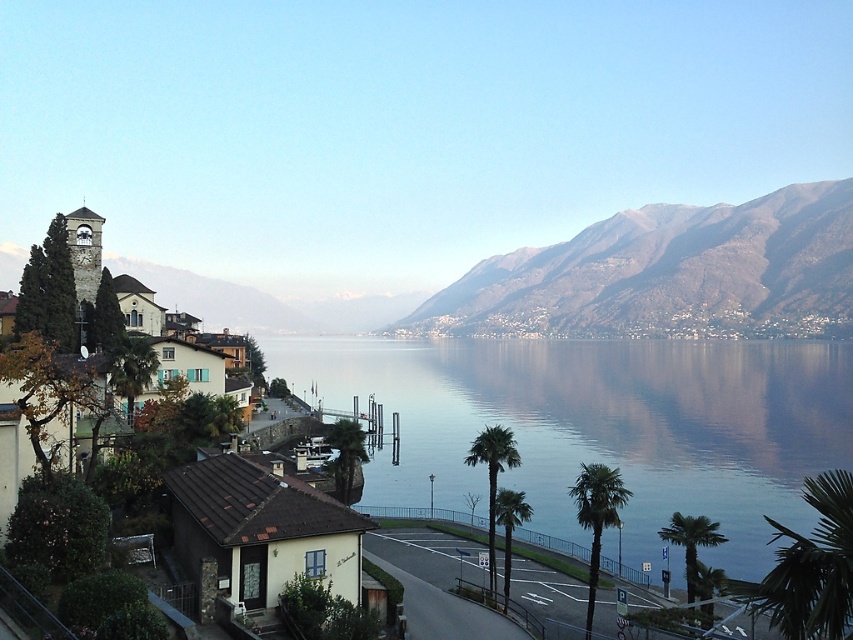
Question: Which point appears farthest from the camera in this image?

Choices:
 (A) (488, 525)
 (B) (590, 614)
 (C) (78, 259)

Answer: (C)

Question: Does gray rocky mountains at upper right have a larger size compared to green leafy palm trees at center?

Choices:
 (A) no
 (B) yes

Answer: (B)

Question: Which point is closer to the camera?

Choices:
 (A) green leafy palm tree at center
 (B) gray rocky mountains at upper right

Answer: (A)

Question: From the image, what is the correct spatial relationship of transparent water at center in relation to green leafy palm tree at center?

Choices:
 (A) above
 (B) below

Answer: (A)

Question: Is transparent water at center behind green leafy palm tree at center-right?

Choices:
 (A) yes
 (B) no

Answer: (A)

Question: Among these points, which one is nearest to the camera?

Choices:
 (A) (611, 477)
 (B) (506, 460)

Answer: (A)